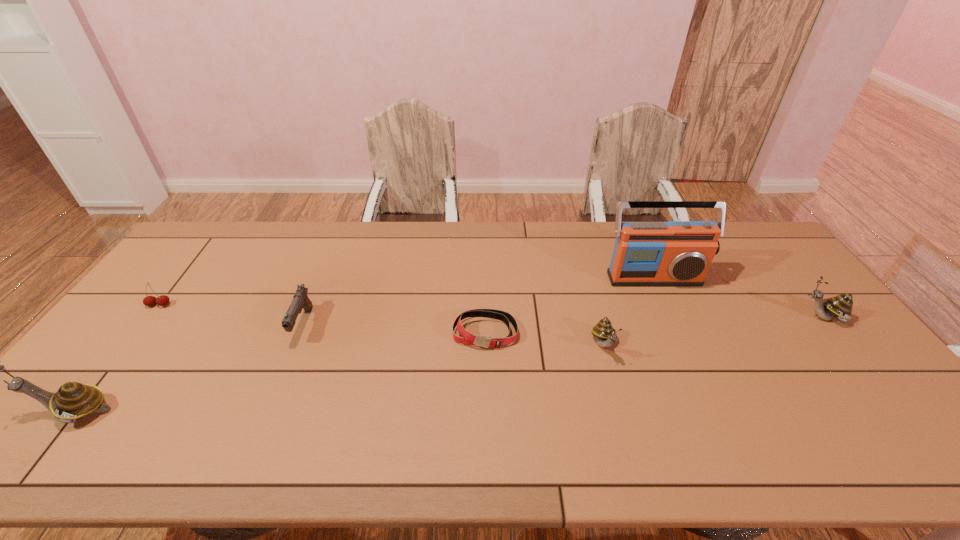
This screenshot has width=960, height=540. I want to click on snail that is the closest to the nearest object, so click(606, 335).

Where is `snail identified as the second closest to the cherry`? This screenshot has width=960, height=540. snail identified as the second closest to the cherry is located at coordinates (606, 335).

Find the location of a particular element. The image size is (960, 540). vacant space that satisfies the following two spatial constraints: 1. on the face of the second shortest snail; 2. on the face of the second snail from left to right is located at coordinates (844, 345).

Find the location of a particular element. free spot that satisfies the following two spatial constraints: 1. on the surface of the cherry; 2. on the face of the nearest snail is located at coordinates (77, 411).

The image size is (960, 540). I want to click on vacant space that satisfies the following two spatial constraints: 1. on the face of the fifth shortest object; 2. in the direction the gun is aimed, so click(828, 325).